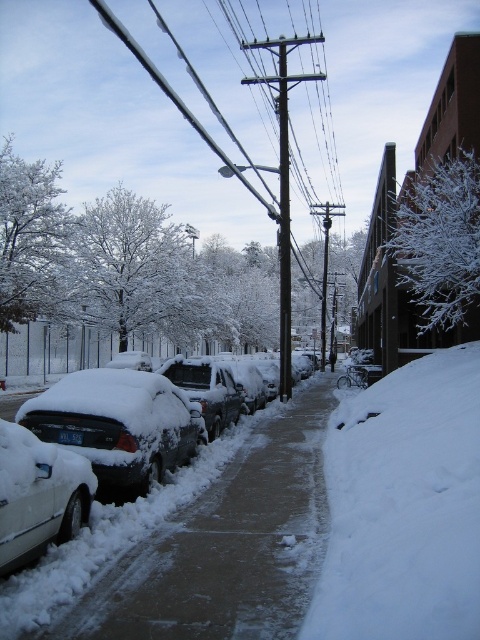
Does point (254, 513) lie behind point (456, 189)?

No, it is not.

Between point (301, 422) and point (446, 310), which one is positioned behind?

Positioned behind is point (301, 422).

At what (x,y) coordinates should I click in order to perform the action: click on white snow-covered sidewalk at center. Please return your answer as a coordinate pair (x, y). Looking at the image, I should click on (227, 545).

The image size is (480, 640). What do you see at coordinates (440, 241) in the screenshot?
I see `white frosty tree at center-right` at bounding box center [440, 241].

The height and width of the screenshot is (640, 480). In order to click on white frosty tree at center-right in this screenshot , I will do `click(440, 241)`.

Is point (445, 275) closer to camera compared to point (288, 147)?

Yes, it is.

You are a GUI agent. You are given a task and a screenshot of the screen. Output one action in this format:
    pyautogui.click(x=<x>, y=<y>)
    Task: Click on the white frosty tree at center-right
    The height and width of the screenshot is (640, 480).
    Given the screenshot: What is the action you would take?
    pyautogui.click(x=440, y=241)

Consider the image. Between white snow-covered sidewalk at center and smooth black pole at center, which one is positioned lower?

Positioned lower is white snow-covered sidewalk at center.

Which of these two, white snow-covered sidewalk at center or smooth black pole at center, stands taller?

With more height is smooth black pole at center.

What are the coordinates of `white snow-covered sidewalk at center` in the screenshot? It's located at (227, 545).